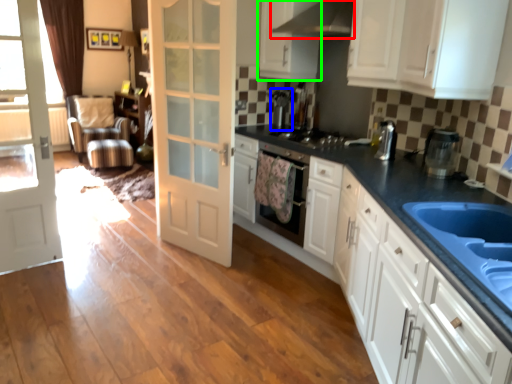
Question: Considering the real-world distances, which object is closest to exhaust hood (highlighted by a red box)? coffee machine (highlighted by a blue box) or cabinetry (highlighted by a green box).

Choices:
 (A) coffee machine
 (B) cabinetry

Answer: (B)